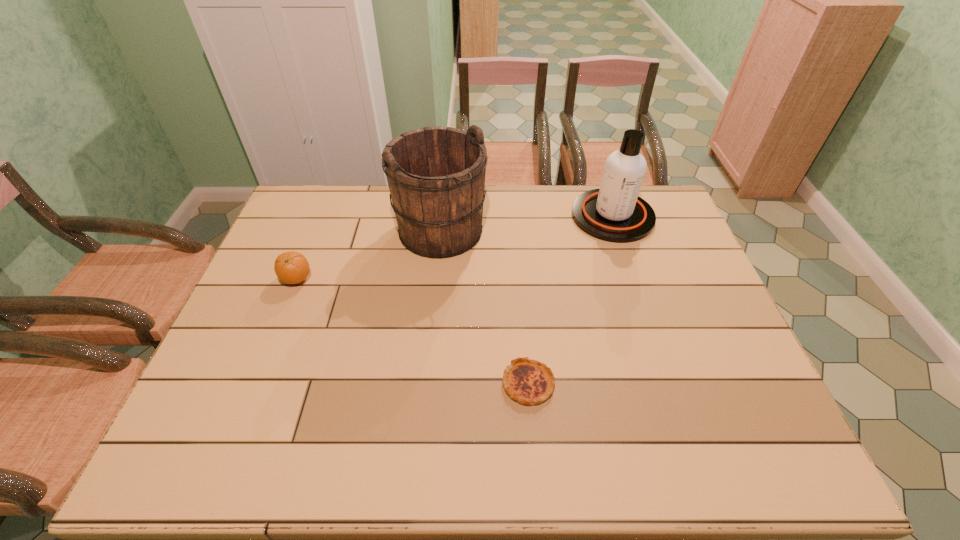
The image size is (960, 540). Find the location of `free space between the third object from left to right and the bucket`. free space between the third object from left to right and the bucket is located at coordinates point(485,307).

At what (x,y) coordinates should I click in order to perform the action: click on free space between the cleansing agent and the bucket. Please return your answer as a coordinate pair (x, y). This screenshot has width=960, height=540. Looking at the image, I should click on (527, 224).

I want to click on free space between the second object from left to right and the quiche, so click(x=485, y=307).

Where is `vacant space that's between the rightmost object and the nearest object`? The height and width of the screenshot is (540, 960). vacant space that's between the rightmost object and the nearest object is located at coordinates (570, 300).

Locate an element on the screen. free space between the cleansing agent and the bucket is located at coordinates (527, 224).

Locate an element on the screen. free space between the shortest object and the leftmost object is located at coordinates (413, 331).

The image size is (960, 540). In order to click on vacant area that lies between the quiche and the cleansing agent in this screenshot , I will do `click(570, 300)`.

Identify the location of free area in between the third object from right to left and the second nearest object. (369, 255).

Locate an element on the screen. the second closest object to the rightmost object is located at coordinates (529, 382).

Select which object is the second closest to the cleansing agent. Please provide its 2D coordinates. Your answer should be formatted as a tuple, i.e. [(x, y)], where the tuple contains the x and y coordinates of a point satisfying the conditions above.

[(529, 382)]